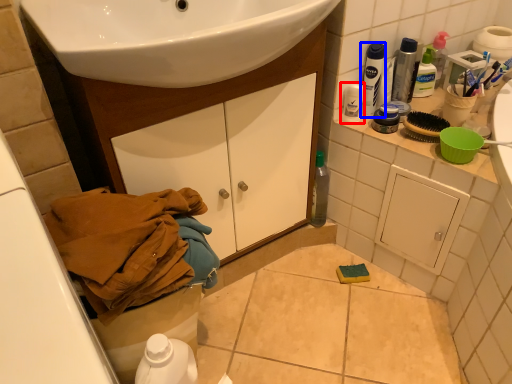
Question: Which of the following is the closest to the observer, toiletry (highlighted by a red box) or mouthwash (highlighted by a blue box)?

Choices:
 (A) toiletry
 (B) mouthwash

Answer: (B)